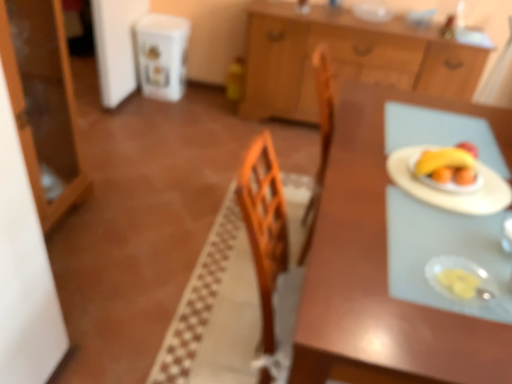
The image size is (512, 384). Identify the location of vacant space situated above white paper plate at right (from a real-world perspective). (460, 182).